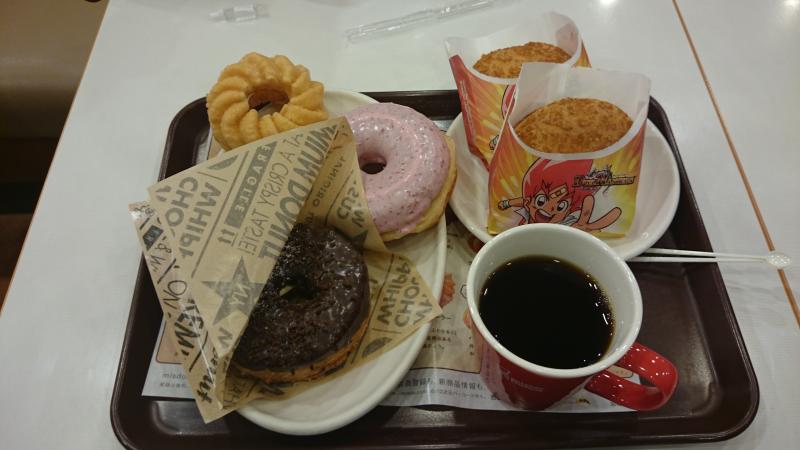
The image size is (800, 450). I want to click on table, so click(x=149, y=62).